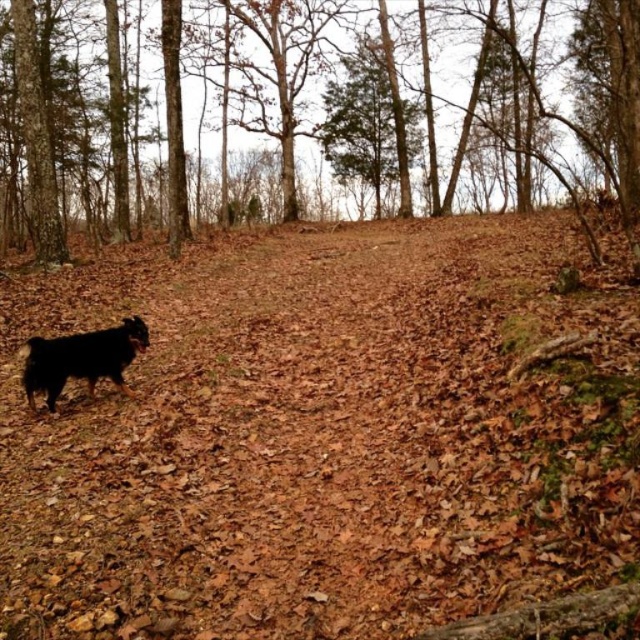
Question: Which point is farther from the camera taking this photo?

Choices:
 (A) (28, 20)
 (B) (49, 364)

Answer: (A)

Question: Does brown bark tree at left have a larger size compared to shaggy brown dog at lower left?

Choices:
 (A) no
 (B) yes

Answer: (B)

Question: Can you confirm if brown bark tree at left is thinner than shaggy brown dog at lower left?

Choices:
 (A) no
 (B) yes

Answer: (A)

Question: Can you confirm if brown bark tree at left is wider than shaggy brown dog at lower left?

Choices:
 (A) yes
 (B) no

Answer: (A)